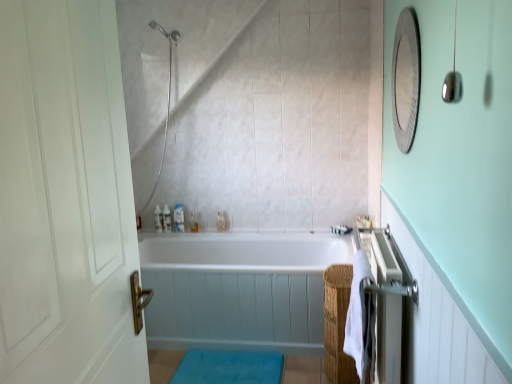
Describe the element at coordinates (166, 219) in the screenshot. I see `translucent plastic bottles at upper center, positioned as the 2th toiletry in left-to-right order` at that location.

This screenshot has width=512, height=384. What do you see at coordinates (193, 222) in the screenshot? I see `white glossy bottle at upper center, placed as the 3th toiletry when sorted from left to right` at bounding box center [193, 222].

This screenshot has height=384, width=512. I want to click on white glossy bottle at upper center, which ranks as the 2th toiletry in right-to-left order, so click(193, 222).

Describe the element at coordinates (65, 198) in the screenshot. This screenshot has width=512, height=384. I see `white matte door at left` at that location.

Where is `white matte door at left`? This screenshot has width=512, height=384. white matte door at left is located at coordinates (65, 198).

Where is `silver textured mirror at upper right`? silver textured mirror at upper right is located at coordinates (406, 79).

From a real-world perspective, which object rests below the other?

translucent plastic bottle at upper center, the fourth toiletry viewed from the left.

Is translucent plastic bottle at upper center, the fourth toiletry viewed from the left, in contact with white plastic toiletries at center, arranged as the 4th toiletry when viewed from the right?

No, translucent plastic bottle at upper center, the fourth toiletry viewed from the left, is not with white plastic toiletries at center, arranged as the 4th toiletry when viewed from the right.

Is translucent plastic bottle at upper center, marked as the 1th toiletry in a right-to-left arrangement, looking in the opposite direction of white plastic toiletries at center, arranged as the 4th toiletry when viewed from the right?

That's not correct — translucent plastic bottle at upper center, marked as the 1th toiletry in a right-to-left arrangement, is not looking away from white plastic toiletries at center, arranged as the 4th toiletry when viewed from the right.

From the image's perspective, which is below, translucent plastic bottle at upper center, marked as the 1th toiletry in a right-to-left arrangement, or white plastic toiletries at center, arranged as the 4th toiletry when viewed from the right?

From the image's view, translucent plastic bottle at upper center, marked as the 1th toiletry in a right-to-left arrangement, is below.

Can you confirm if white soft towel at right is positioned to the left of white glossy bottle at upper center, placed as the 3th toiletry when sorted from left to right?

No.

From a real-world perspective, is white soft towel at right positioned under white glossy bottle at upper center, which ranks as the 2th toiletry in right-to-left order, based on gravity?

No, from a real-world perspective, white soft towel at right is not beneath white glossy bottle at upper center, which ranks as the 2th toiletry in right-to-left order.

Does point (362, 285) come farther from viewer compared to point (193, 221)?

No, (362, 285) is in front of (193, 221).

At what (x,y) coordinates should I click in order to perform the action: click on toiletry that is the 1st one when counting upward from the white soft towel at right (from the image's perspective). Please return your answer as a coordinate pair (x, y). Looking at the image, I should click on [x=193, y=222].

Considering the relative sizes of white matte door at left and white plastic toiletries at center, arranged as the 4th toiletry when viewed from the right, in the image provided, is white matte door at left bigger than white plastic toiletries at center, arranged as the 4th toiletry when viewed from the right,?

Yes.

Locate an element on the screen. The width and height of the screenshot is (512, 384). door located above the white plastic toiletries at center, arranged as the 4th toiletry when viewed from the right (from the image's perspective) is located at coordinates (65, 198).

Is white matte door at left next to white plastic toiletries at center, arranged as the 4th toiletry when viewed from the right?

No, white matte door at left is not making contact with white plastic toiletries at center, arranged as the 4th toiletry when viewed from the right.

Is white matte door at left located outside white plastic toiletries at center, arranged as the 4th toiletry when viewed from the right?

Yes, white matte door at left is not within white plastic toiletries at center, arranged as the 4th toiletry when viewed from the right.

Can you confirm if translucent plastic bottle at upper center, the fourth toiletry viewed from the left, is taller than silver textured mirror at upper right?

No.

Does translucent plastic bottle at upper center, marked as the 1th toiletry in a right-to-left arrangement, have a smaller size compared to silver textured mirror at upper right?

Correct, translucent plastic bottle at upper center, marked as the 1th toiletry in a right-to-left arrangement, occupies less space than silver textured mirror at upper right.

Can we say translucent plastic bottle at upper center, the fourth toiletry viewed from the left, lies outside silver textured mirror at upper right?

Yes.

From a real-world perspective, who is located lower, translucent plastic bottle at upper center, the fourth toiletry viewed from the left, or silver textured mirror at upper right?

translucent plastic bottle at upper center, the fourth toiletry viewed from the left.

Is white plastic toiletries at center, arranged as the first toiletry when viewed from the left, positioned with its back to silver metallic towel rack at right?

white plastic toiletries at center, arranged as the first toiletry when viewed from the left, does not have its back to silver metallic towel rack at right.

Does point (155, 222) come in front of point (397, 247)?

No, (155, 222) is behind (397, 247).

Based on their sizes in the image, would you say white plastic toiletries at center, arranged as the 4th toiletry when viewed from the right, is bigger or smaller than silver metallic towel rack at right?

Clearly, white plastic toiletries at center, arranged as the 4th toiletry when viewed from the right, is smaller in size than silver metallic towel rack at right.

Can you confirm if white plastic toiletries at center, arranged as the first toiletry when viewed from the left, is thinner than silver metallic towel rack at right?

Correct, the width of white plastic toiletries at center, arranged as the first toiletry when viewed from the left, is less than that of silver metallic towel rack at right.

Is white soft towel at right not near silver metallic towel rack at right?

No, white soft towel at right is not far away from silver metallic towel rack at right.

Looking at this image, considering the relative sizes of white soft towel at right and silver metallic towel rack at right in the image provided, is white soft towel at right shorter than silver metallic towel rack at right?

Correct, white soft towel at right is not as tall as silver metallic towel rack at right.

Looking at this image, what's the angular difference between white soft towel at right and silver metallic towel rack at right's facing directions?

They differ by 0.00106 degrees in their facing directions.

You are a GUI agent. You are given a task and a screenshot of the screen. Output one action in this format:
    pyautogui.click(x=<x>, y=<y>)
    Task: Click on the closet in front of the white soft towel at right
    
    Given the screenshot: What is the action you would take?
    pyautogui.click(x=385, y=299)

How far apart are white plastic toiletries at center, arranged as the 4th toiletry when viewed from the right, and translucent plastic bottle at upper center, marked as the 1th toiletry in a right-to-left arrangement?

white plastic toiletries at center, arranged as the 4th toiletry when viewed from the right, is 18.16 inches away from translucent plastic bottle at upper center, marked as the 1th toiletry in a right-to-left arrangement.

From their relative heights in the image, would you say white plastic toiletries at center, arranged as the first toiletry when viewed from the left, is taller or shorter than translucent plastic bottle at upper center, marked as the 1th toiletry in a right-to-left arrangement?

In the image, white plastic toiletries at center, arranged as the first toiletry when viewed from the left, appears to be taller than translucent plastic bottle at upper center, marked as the 1th toiletry in a right-to-left arrangement.

Looking at this image, from the image's perspective, is white plastic toiletries at center, arranged as the first toiletry when viewed from the left, beneath translucent plastic bottle at upper center, marked as the 1th toiletry in a right-to-left arrangement?

Incorrect, from the image's perspective, white plastic toiletries at center, arranged as the first toiletry when viewed from the left, is higher than translucent plastic bottle at upper center, marked as the 1th toiletry in a right-to-left arrangement.

Is white plastic toiletries at center, arranged as the first toiletry when viewed from the left, surrounding translucent plastic bottle at upper center, the fourth toiletry viewed from the left?

Actually, translucent plastic bottle at upper center, the fourth toiletry viewed from the left, is outside white plastic toiletries at center, arranged as the first toiletry when viewed from the left.

From the image's perspective, count 1st toiletrys downward from the white plastic toiletries at center, arranged as the first toiletry when viewed from the left, and point to it. Please provide its 2D coordinates.

[(221, 222)]

Find the location of a particular element. beach towel in front of the white glossy bottle at upper center, which ranks as the 2th toiletry in right-to-left order is located at coordinates (360, 317).

When comparing their distances from white glossy bathtub at center, does silver textured mirror at upper right or white glossy bottle at upper center, which ranks as the 2th toiletry in right-to-left order, seem further?

silver textured mirror at upper right is further to white glossy bathtub at center.

Consider the image. Which object lies nearer to the anchor point translucent plastic bottle at upper center, marked as the 1th toiletry in a right-to-left arrangement, silver metallic towel rack at right or white soft towel at right?

white soft towel at right is closer to translucent plastic bottle at upper center, marked as the 1th toiletry in a right-to-left arrangement.

Based on their spatial positions, is silver metallic towel rack at right or white matte door at left closer to translucent plastic bottles at upper center, positioned as the 2th toiletry in left-to-right order?

silver metallic towel rack at right.

Considering their positions, is white soft towel at right positioned closer to white glossy bottle at upper center, placed as the 3th toiletry when sorted from left to right, than white matte door at left?

Among the two, white soft towel at right is located nearer to white glossy bottle at upper center, placed as the 3th toiletry when sorted from left to right.

When comparing their distances from silver textured mirror at upper right, does white soft towel at right or blue plush bath mat at lower center seem closer?

white soft towel at right is positioned closer to the anchor silver textured mirror at upper right.

From the image, which object appears to be farther from translucent plastic bottles at upper center, positioned as the 2th toiletry in left-to-right order, white plastic toiletries at center, arranged as the first toiletry when viewed from the left, or white glossy bathtub at center?

white glossy bathtub at center is further to translucent plastic bottles at upper center, positioned as the 2th toiletry in left-to-right order.

Considering their positions, is blue plush bath mat at lower center positioned further to white glossy bathtub at center than white matte door at left?

white matte door at left.

From the picture: Looking at the image, which one is located further to translucent plastic bottle at upper center, marked as the 1th toiletry in a right-to-left arrangement, white soft towel at right or white glossy bathtub at center?

white soft towel at right is positioned further to the anchor translucent plastic bottle at upper center, marked as the 1th toiletry in a right-to-left arrangement.

This screenshot has width=512, height=384. Find the location of `bath mat between white soft towel at right and translucent plastic bottle at upper center, the fourth toiletry viewed from the left, from front to back`. bath mat between white soft towel at right and translucent plastic bottle at upper center, the fourth toiletry viewed from the left, from front to back is located at coordinates (229, 367).

At what (x,y) coordinates should I click in order to perform the action: click on closet between white matte door at left and white soft towel at right from front to back. Please return your answer as a coordinate pair (x, y). Looking at the image, I should click on (385, 299).

Image resolution: width=512 pixels, height=384 pixels. I want to click on closet positioned between white matte door at left and blue plush bath mat at lower center from near to far, so click(x=385, y=299).

Image resolution: width=512 pixels, height=384 pixels. I want to click on beach towel positioned between silver metallic towel rack at right and blue plush bath mat at lower center from near to far, so click(360, 317).